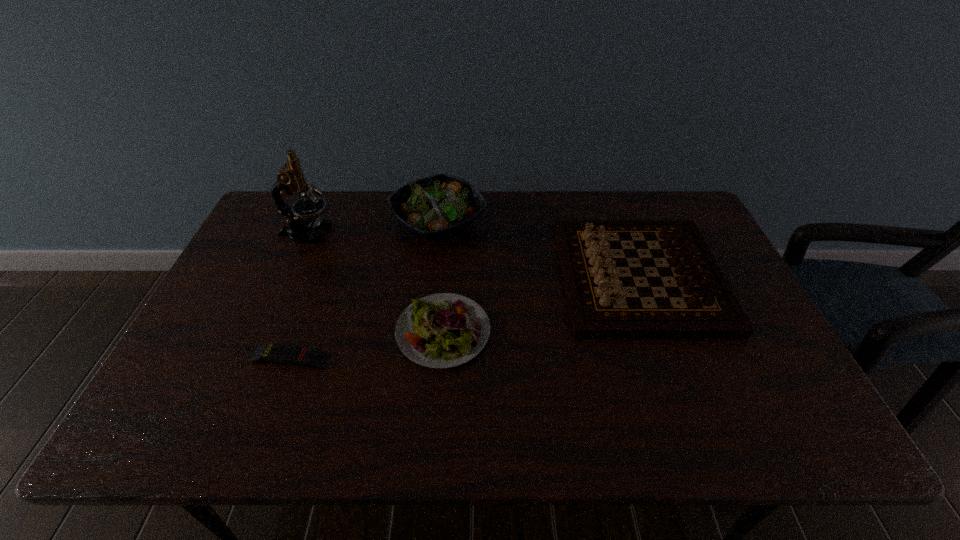
Locate an element on the screen. vacant space situated 0.250m on the side with the white pieces of the gameboard is located at coordinates (476, 277).

Where is `vacant space located 0.260m on the left of the fourth tallest object`? This screenshot has width=960, height=540. vacant space located 0.260m on the left of the fourth tallest object is located at coordinates (296, 332).

The image size is (960, 540). In order to click on blank space located on the right of the shortest object in this screenshot , I will do `click(468, 358)`.

Identify the location of microscope at the far edge. This screenshot has height=540, width=960. (291, 178).

Where is `salad plate that is at the far edge`? salad plate that is at the far edge is located at coordinates (433, 207).

This screenshot has width=960, height=540. What are the coordinates of `gameboard at the far edge` in the screenshot? It's located at (600, 305).

This screenshot has width=960, height=540. Find the location of `object located at the left edge`. object located at the left edge is located at coordinates (291, 178).

The image size is (960, 540). Identify the location of object located in the right edge section of the desktop. (600, 305).

Find the location of a particular element. The height and width of the screenshot is (540, 960). object present at the far left corner is located at coordinates (291, 178).

Identify the location of object located in the far right corner section of the desktop. (600, 305).